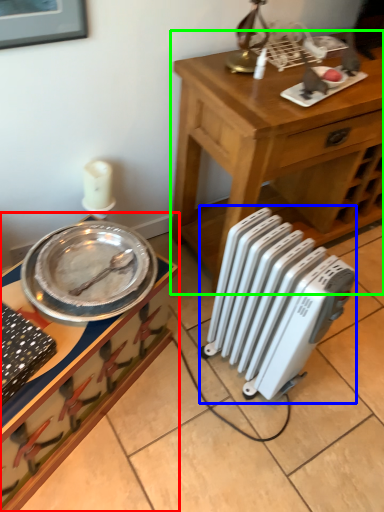
Question: Considering the real-world distances, which object is closest to desk (highlighted by a red box)? radiator (highlighted by a blue box) or table (highlighted by a green box).

Choices:
 (A) radiator
 (B) table

Answer: (A)